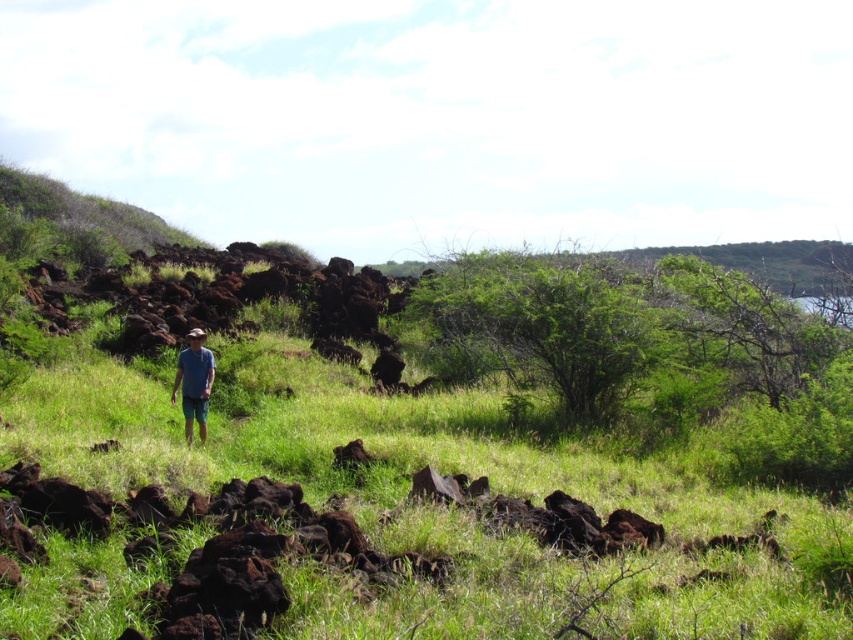
Between brown rough rocks at center and blue fabric shirt at center, which one has less height?

With less height is blue fabric shirt at center.

Is brown rough rocks at center closer to the viewer compared to blue fabric shirt at center?

That is True.

Who is more forward, (199, 611) or (189, 348)?

Point (199, 611)

Find the location of a particular element. The height and width of the screenshot is (640, 853). brown rough rocks at center is located at coordinates (404, 509).